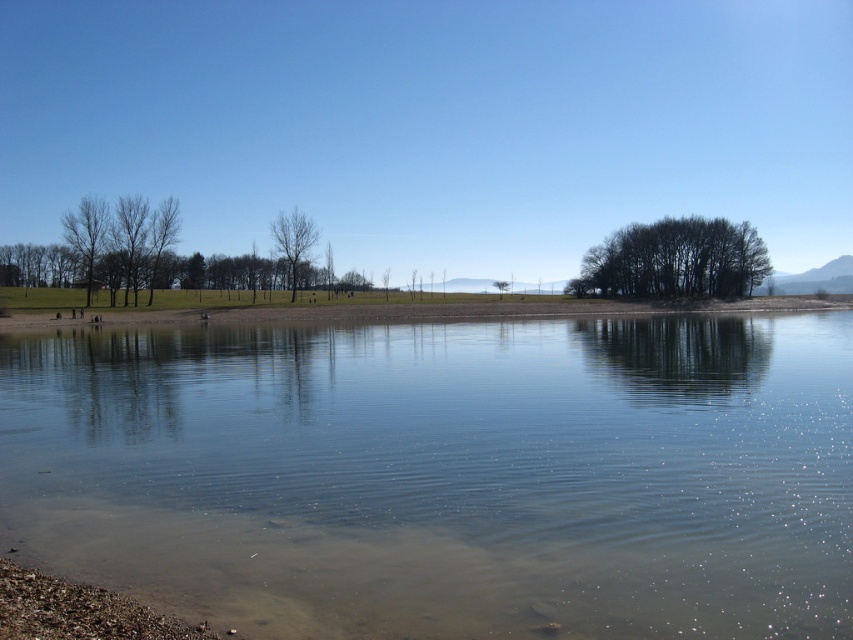
You are planning to set up a small tent for a lakeside camping trip. You want to choose a spot that is closer to the water but also has some tree cover for privacy. Given the dark brown textured trees at center right and the bare branches at left, which tree group should you choose for better privacy and why?

The dark brown textured trees at center right are larger in size than the bare branches at left, so choosing the dark brown textured trees at center right would provide better privacy due to their larger size and denser foliage.

You are standing at the lakeside and want to walk from the brown sand at center to the dark brown textured trees at center right. Which direction should you head to reach them?

To reach the dark brown textured trees at center right from the brown sand at center, you should head towards the right since the dark brown textured trees at center right are located to the right of the brown sand at center.

You are standing on the sandy shoreline and want to walk to the dark brown textured trees at center right. Which direction should you head towards from the clear water at center?

You should head towards the right from the clear water at center since it is positioned on the left side of the dark brown textured trees at center right.